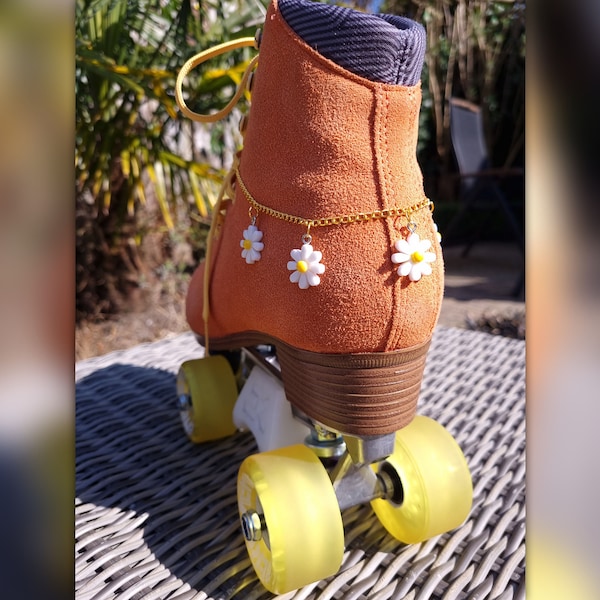
The width and height of the screenshot is (600, 600). I want to click on ankle cushion, so click(x=376, y=45).